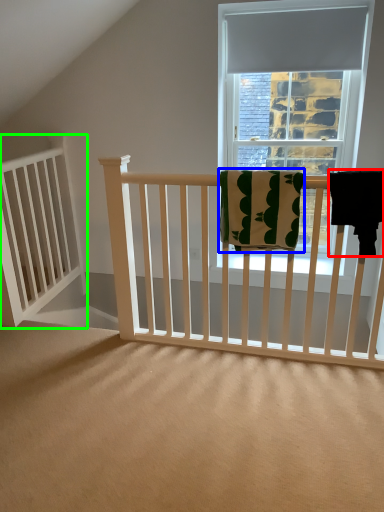
Question: Considering the real-world distances, which object is closest to beach towel (highlighted by a red box)? beach towel (highlighted by a blue box) or balustrade (highlighted by a green box).

Choices:
 (A) beach towel
 (B) balustrade

Answer: (A)